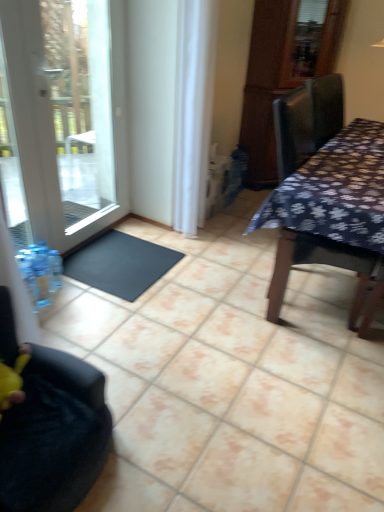
Question: Visually, is white glass door at left positioned to the left or to the right of black rubber doormat at lower left?

Choices:
 (A) right
 (B) left

Answer: (B)

Question: Considering the positions of white glass door at left and black rubber doormat at lower left in the image, is white glass door at left taller or shorter than black rubber doormat at lower left?

Choices:
 (A) short
 (B) tall

Answer: (B)

Question: Which object is positioned closest to the black fabric chair at lower left?

Choices:
 (A) black rubber doormat at lower left
 (B) white glass door at left
 (C) dark floral fabric table at right
 (D) white sheer curtain at center

Answer: (A)

Question: Estimate the real-world distances between objects in this image. Which object is closer to the white glass door at left?

Choices:
 (A) black fabric chair at lower left
 (B) white sheer curtain at center
 (C) dark floral fabric table at right
 (D) black rubber doormat at lower left

Answer: (D)